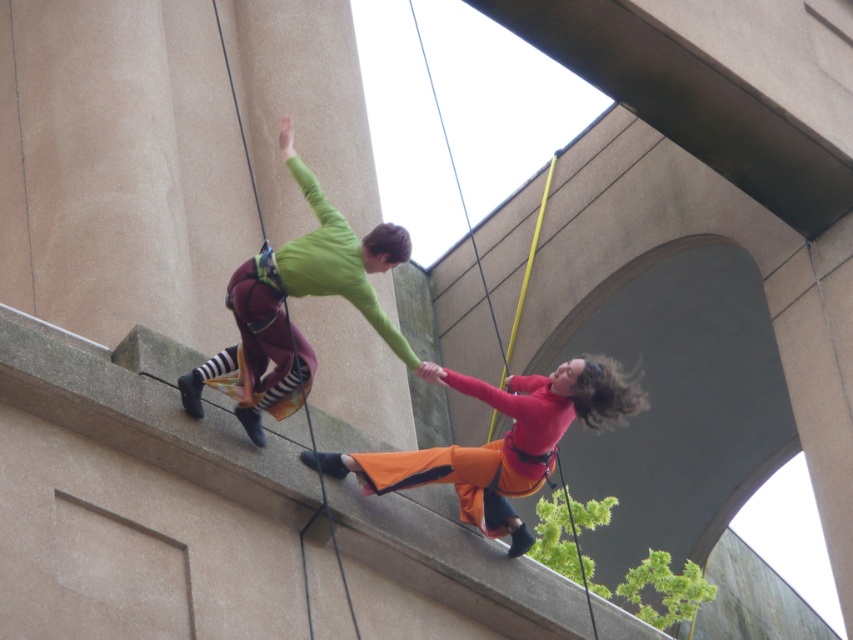
You are standing below the two individuals rappelling down the building. You notice two points marked on the image. Which point, point (479, 452) or point (308, 349), is closer to you?

Point (479, 452) is closer to you because it is further to the viewer than point (308, 349).

You are standing at the base of the building and want to reach the point marked as point (379, 268). The safety rope you have can extend up to 150 feet. Will the rope be sufficient to reach that point?

The distance of point (379, 268) from the camera is 152.35 feet, which exceeds the 150 feet maximum extension of the safety rope. Therefore, the rope will not be sufficient to reach that point.